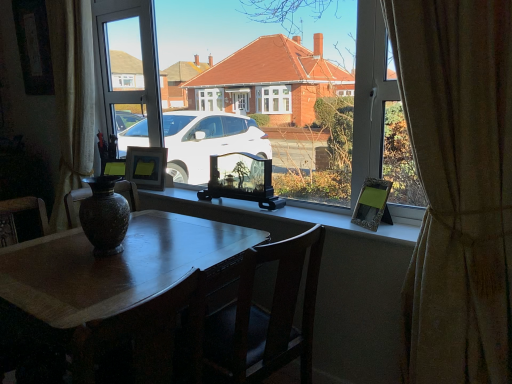
You are a GUI agent. You are given a task and a screenshot of the screen. Output one action in this format:
    pyautogui.click(x=<x>, y=<y>)
    Task: Click on the free spot in front of marbled stone vase at center
    The image size is (512, 384).
    Given the screenshot: What is the action you would take?
    pyautogui.click(x=87, y=264)